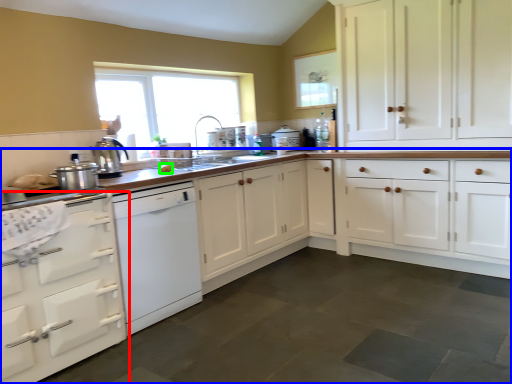
Question: Which object is the closest to the cabinetry (highlighted by a red box)? Choose among these: countertop (highlighted by a blue box) or food (highlighted by a green box).

Choices:
 (A) countertop
 (B) food

Answer: (B)